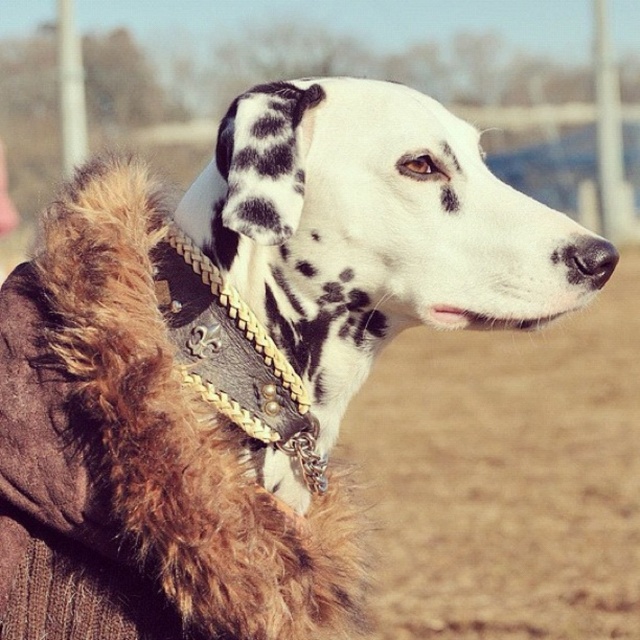
Question: Where is brown dirt field at lower right located in relation to leather/golden chain neckband at upper center in the image?

Choices:
 (A) below
 (B) above

Answer: (A)

Question: Which point appears closest to the camera in this image?

Choices:
 (A) (246, 404)
 (B) (529, 333)

Answer: (A)

Question: Considering the relative positions of brown dirt field at lower right and leather/golden chain neckband at upper center in the image provided, where is brown dirt field at lower right located with respect to leather/golden chain neckband at upper center?

Choices:
 (A) right
 (B) left

Answer: (A)

Question: Which of the following is the closest to the observer?

Choices:
 (A) brown dirt field at lower right
 (B) leather/golden chain neckband at upper center

Answer: (B)

Question: Does brown dirt field at lower right lie in front of leather/golden chain neckband at upper center?

Choices:
 (A) yes
 (B) no

Answer: (B)